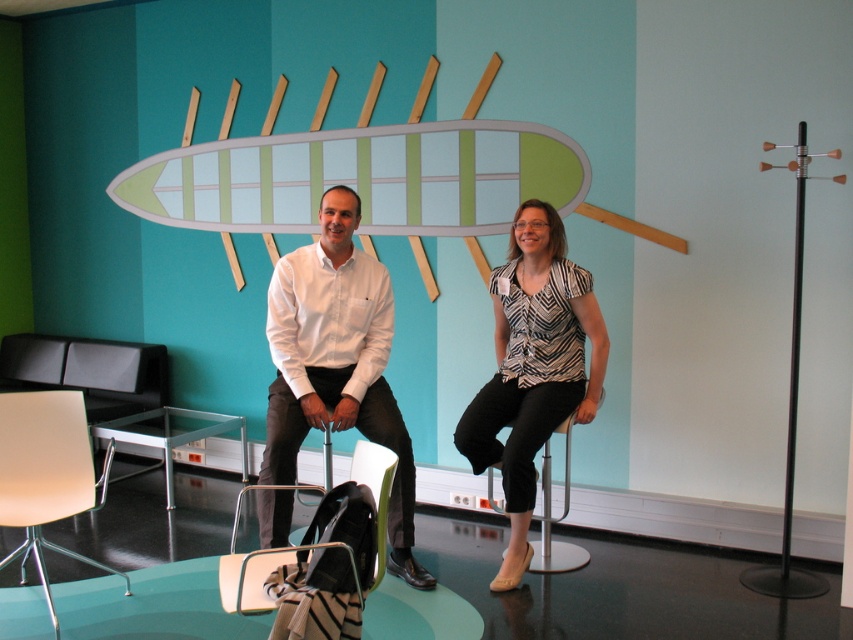
Is white glossy shirt at center shorter than clear plastic chair at center?

No.

Can you confirm if white glossy shirt at center is wider than clear plastic chair at center?

Yes.

Describe the element at coordinates (337, 362) in the screenshot. I see `white glossy shirt at center` at that location.

This screenshot has width=853, height=640. I want to click on white glossy shirt at center, so click(x=337, y=362).

Does patterned fabric blouse at center appear under clear plastic chair at center?

No, patterned fabric blouse at center is not below clear plastic chair at center.

At what (x,y) coordinates should I click in order to perform the action: click on patterned fabric blouse at center. Please return your answer as a coordinate pair (x, y). Looking at the image, I should click on (532, 368).

Is patterned fabric blouse at center shorter than matte white chair at lower left?

Incorrect, patterned fabric blouse at center's height does not fall short of matte white chair at lower left's.

Who is shorter, patterned fabric blouse at center or matte white chair at lower left?

matte white chair at lower left

Which is behind, point (531, 250) or point (91, 502)?

Point (531, 250)

Identify the location of patterned fabric blouse at center. This screenshot has height=640, width=853. (532, 368).